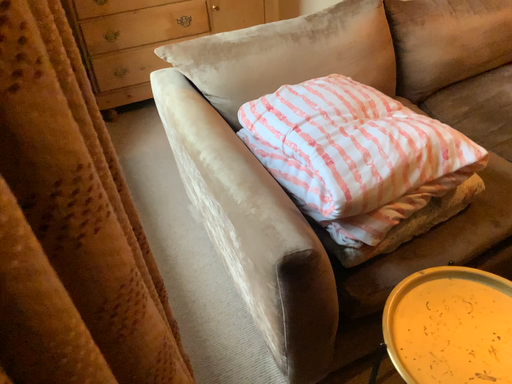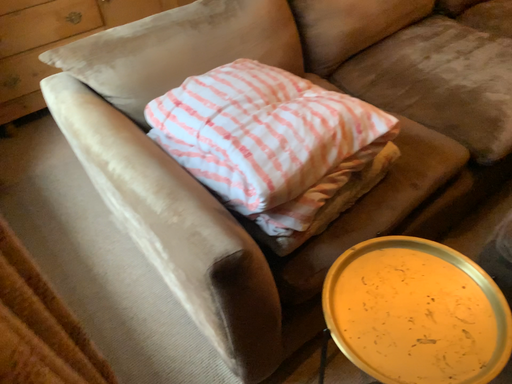
Question: How did the camera likely rotate when shooting the video?

Choices:
 (A) rotated right
 (B) rotated left

Answer: (A)